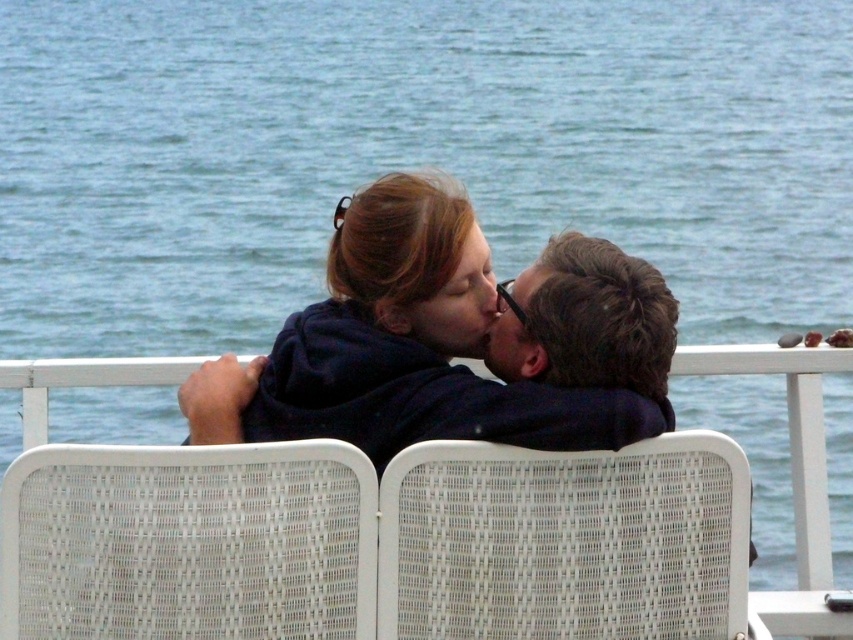
You are standing at the origin point of the image. A dark blue hoodie at center is located at coordinates point (451, 340). If you want to walk towards the dark blue hoodie at center, which direction should you move?

The dark blue hoodie at center is located at coordinates point (451, 340), so you should move towards the center of the image to reach it.

In the scene shown: You are a photographer trying to capture a closeup of the dark blue hoodie at center and the dark brown hair at center. Since you want to focus on the hoodie first, which object should you adjust your camera to prioritize in terms of depth of field?

The dark blue hoodie at center is closer to the viewer than dark brown hair at center, so you should prioritize focusing on the dark blue hoodie at center to ensure it is in sharp focus while the dark brown hair at center may appear slightly blurred.